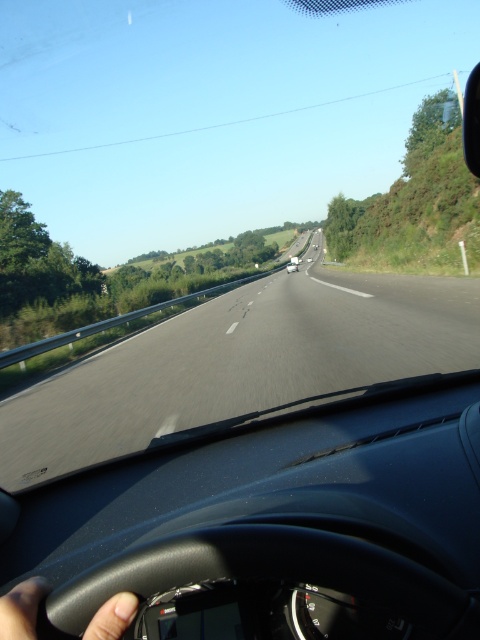
You are sitting in the car and want to know where the asphalt road at center is located. Can you tell me its position using coordinates?

The asphalt road at center is located at coordinates point (240,362).

You are a passenger in the car and want to describe the view outside. Which object, the asphalt road at center or the black matte steering wheel at lower left, appears taller in the scene?

The asphalt road at center appears taller than the black matte steering wheel at lower left in the scene.